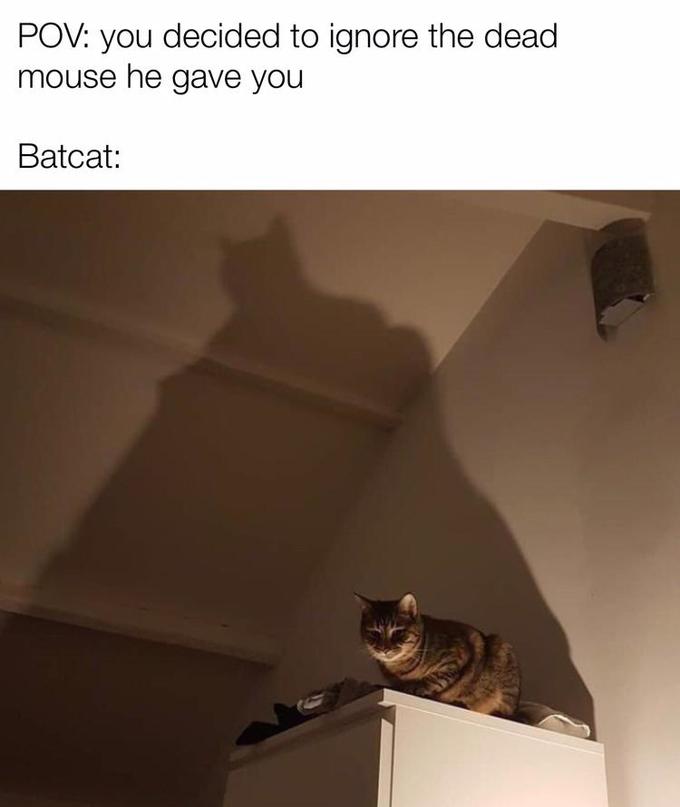
At what (x,y) coordinates should I click in order to perform the action: click on ceiling boards. Please return your answer as a coordinate pair (x, y). Image resolution: width=680 pixels, height=807 pixels. Looking at the image, I should click on (562, 199), (318, 390), (192, 633).